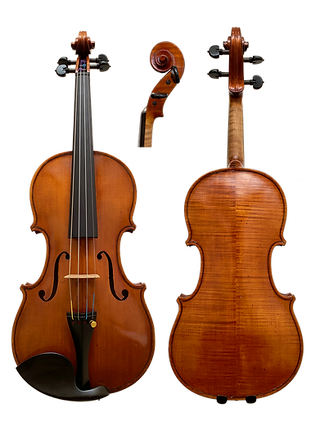
Locate an element on the screen. This screenshot has width=320, height=430. handle is located at coordinates (238, 42).